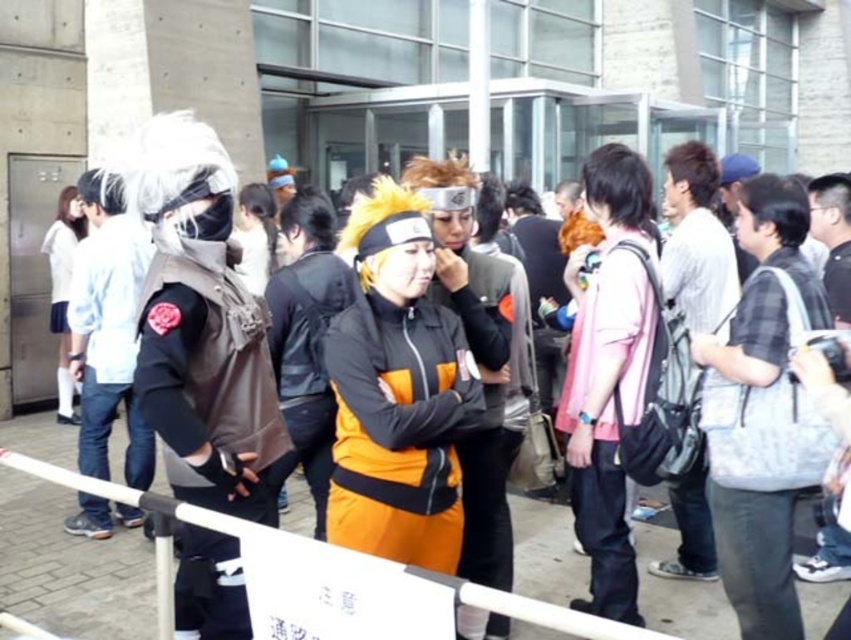
Question: Which point appears closest to the camera in this image?

Choices:
 (A) (157, 285)
 (B) (344, 540)
 (C) (111, 307)

Answer: (A)

Question: Is matte black vest at center below orange matte jacket at center?

Choices:
 (A) yes
 (B) no

Answer: (B)

Question: Which object appears farthest from the camera in this image?

Choices:
 (A) white matte jacket at left
 (B) white plastic barrier at center
 (C) pink fabric shirt at center

Answer: (C)

Question: Estimate the real-world distances between objects in this image. Which object is farther from the white matte jacket at left?

Choices:
 (A) orange matte jacket at center
 (B) matte black vest at center
 (C) pink fabric shirt at center

Answer: (C)

Question: In this image, where is matte black vest at center located relative to white plastic barrier at center?

Choices:
 (A) below
 (B) above

Answer: (B)

Question: Is orange matte jacket at center positioned at the back of white plastic barrier at center?

Choices:
 (A) yes
 (B) no

Answer: (A)